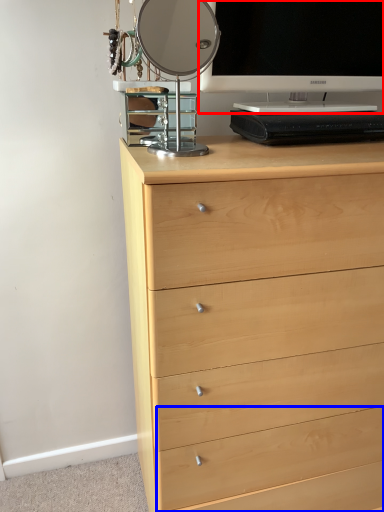
Question: Which of the following is the closest to the observer, television (highlighted by a red box) or drawer (highlighted by a blue box)?

Choices:
 (A) television
 (B) drawer

Answer: (A)